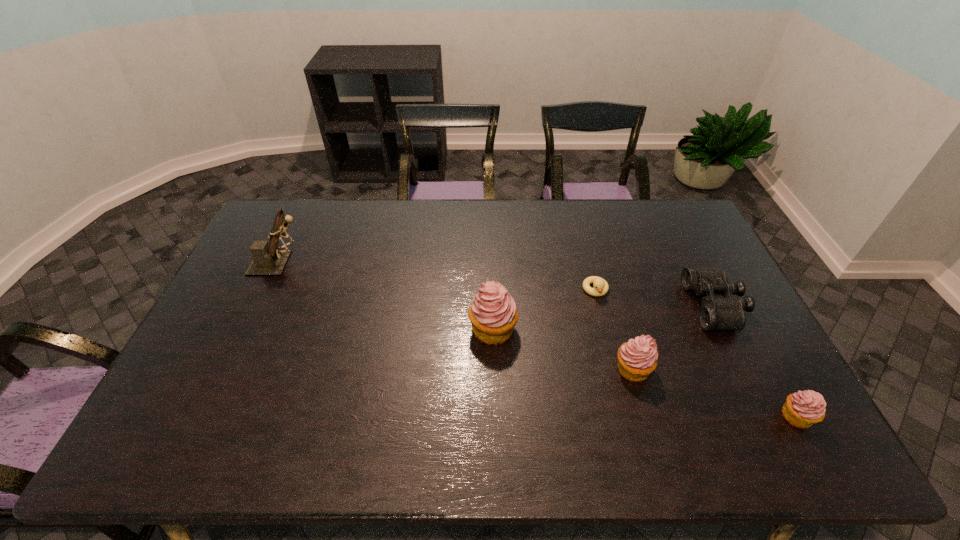
In the current image, all cupcakes are evenly spaced. To maintain this equal spacing, where should an additional cupcake be placed on the left? Please point out a free spot. Please provide its 2D coordinates. Your answer should be formatted as a tuple, i.e. [(x, y)], where the tuple contains the x and y coordinates of a point satisfying the conditions above.

[(372, 295)]